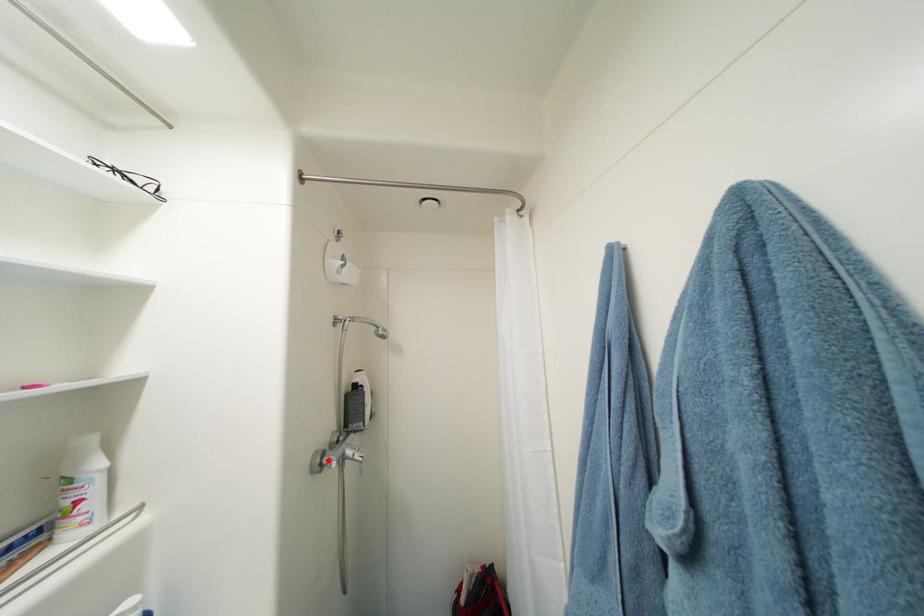
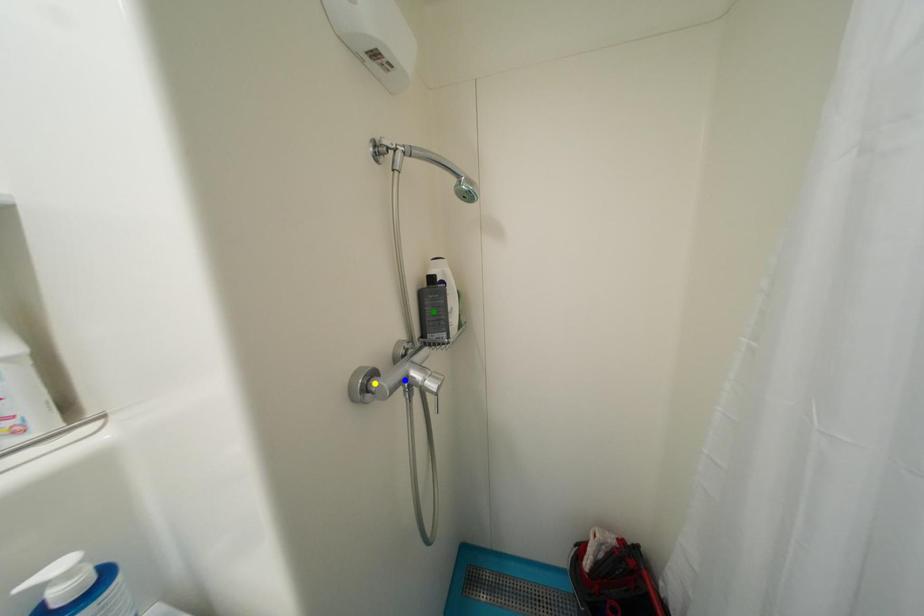
Question: I am providing you with two images of the same scene from different viewpoints. A red point is marked on the first image. You are given multiple points on the second image. Which point in image 2 represents the same 3d spot as the red point in image 1?

Choices:
 (A) yellow point
 (B) blue point
 (C) green point

Answer: (A)